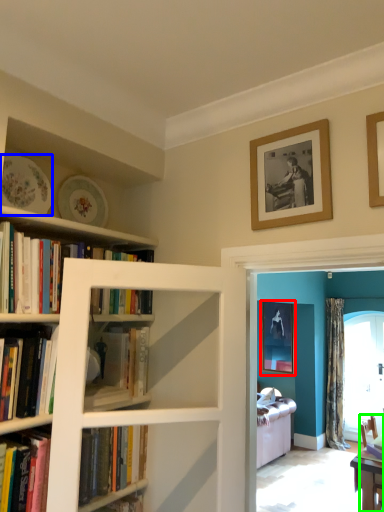
Question: Which object is the farthest from picture frame (highlighted by a red box)? Choose among these: plate (highlighted by a blue box) or chair (highlighted by a green box).

Choices:
 (A) plate
 (B) chair

Answer: (A)